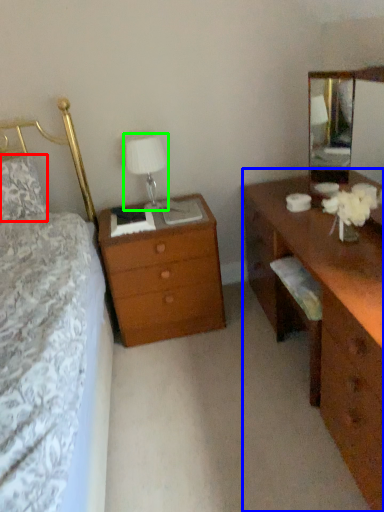
Question: Estimate the real-world distances between objects in this image. Which object is farther from pillow (highlighted by a red box), desk (highlighted by a blue box) or table lamp (highlighted by a green box)?

Choices:
 (A) desk
 (B) table lamp

Answer: (A)